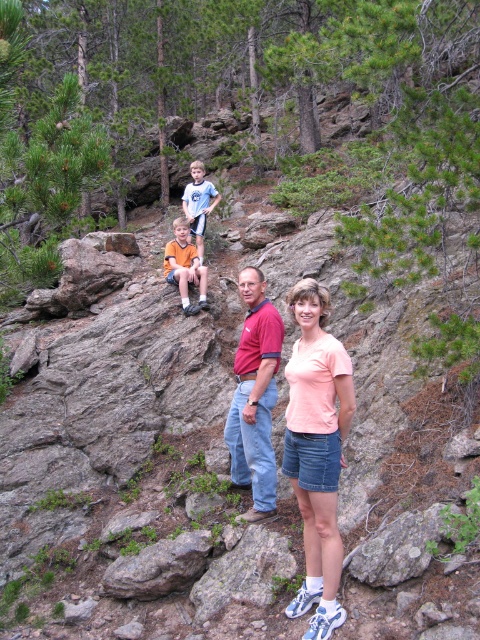
In the family photo taken in a forested area with rocky terrain, there are two men wearing shirts at the center. The first man wears a red cotton polo shirt at center, and the second man wears an orange cotton shirt at center. Which man is more likely to be in front of the other based on their clothing?

The red cotton polo shirt at center is thinner than the orange cotton shirt at center, so the man wearing the red cotton polo shirt at center is more likely to be in front of the other man.